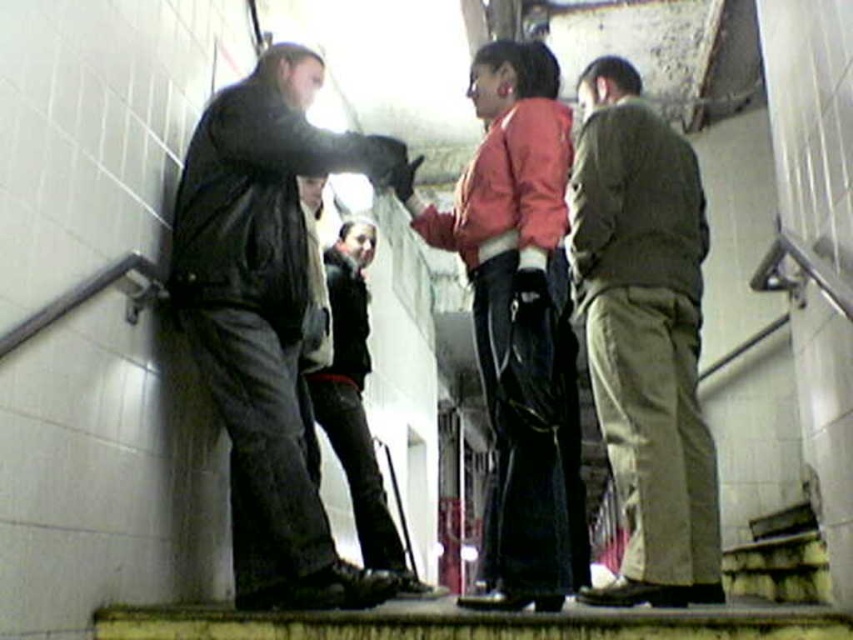
Which is more to the right, dark green fabric pants at right or leather jacket at center?

From the viewer's perspective, dark green fabric pants at right appears more on the right side.

Which is behind, point (635, 365) or point (395, 561)?

The point (395, 561) is behind.

You are a GUI agent. You are given a task and a screenshot of the screen. Output one action in this format:
    pyautogui.click(x=<x>, y=<y>)
    Task: Click on the dark green fabric pants at right
    
    Given the screenshot: What is the action you would take?
    pyautogui.click(x=645, y=336)

Who is positioned more to the left, dark green fabric pants at right or matte pink jacket at center?

Positioned to the left is matte pink jacket at center.

Is point (631, 598) closer to viewer compared to point (436, 212)?

Yes, point (631, 598) is in front of point (436, 212).

Is point (657, 593) closer to camera compared to point (527, 586)?

No, (657, 593) is behind (527, 586).

Find the location of a particular element. The width and height of the screenshot is (853, 640). dark green fabric pants at right is located at coordinates (645, 336).

Between matte black jacket at left and matte pink jacket at center, which one has more height?

matte pink jacket at center

Is the position of matte black jacket at left less distant than that of matte pink jacket at center?

No, matte black jacket at left is further to the viewer.

In order to click on matte black jacket at left in this screenshot , I will do `click(265, 317)`.